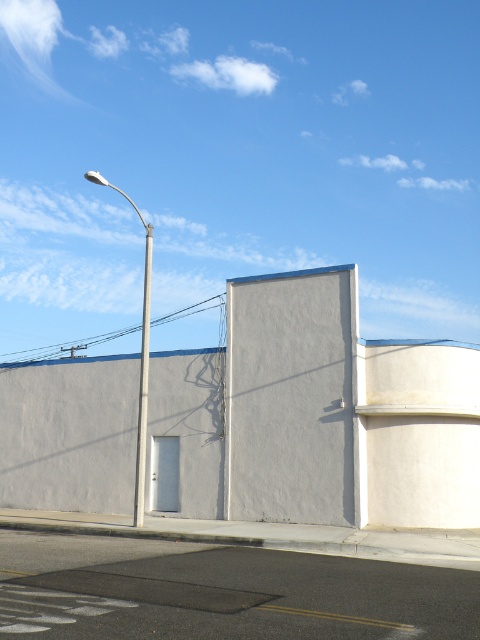
Can you confirm if metallic pole at left is smaller than smooth silver pole at center?

No.

Can you confirm if metallic pole at left is wider than smooth silver pole at center?

Yes.

What are the coordinates of `metallic pole at left` in the screenshot? It's located at (141, 358).

Locate an element on the screen. Image resolution: width=480 pixels, height=640 pixels. metallic pole at left is located at coordinates (141, 358).